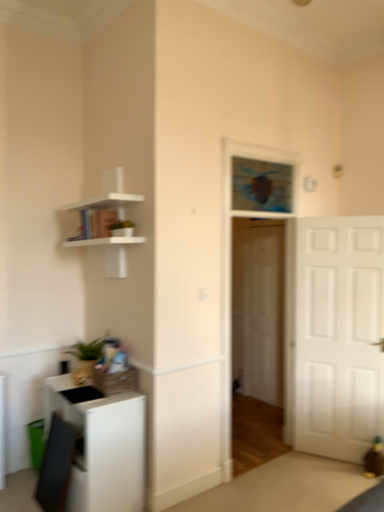
Question: Should I look upward or downward to see white matte cabinet at lower left?

Choices:
 (A) up
 (B) down

Answer: (B)

Question: Which direction should I rotate to look at white wooden door at center, which is the first door from back to front, — up or down?

Choices:
 (A) down
 (B) up

Answer: (A)

Question: Is white matte door at right, acting as the 1th door starting from the front, positioned in front of white matte shelf at upper left?

Choices:
 (A) no
 (B) yes

Answer: (A)

Question: Does white matte door at right, acting as the 1th door starting from the front, appear on the right side of white matte shelf at upper left?

Choices:
 (A) yes
 (B) no

Answer: (A)

Question: Is white matte door at right, acting as the 1th door starting from the front, outside of white matte shelf at upper left?

Choices:
 (A) no
 (B) yes

Answer: (B)

Question: Is white matte door at right, which is the second door in back-to-front order, shorter than white matte shelf at upper left?

Choices:
 (A) no
 (B) yes

Answer: (A)

Question: Could you tell me if white matte door at right, acting as the 1th door starting from the front, is turned towards white matte shelf at upper left?

Choices:
 (A) yes
 (B) no

Answer: (B)

Question: From a real-world perspective, is white matte door at right, acting as the 1th door starting from the front, located higher than white matte shelf at upper left?

Choices:
 (A) yes
 (B) no

Answer: (B)

Question: Is white matte shelf at upper left next to white matte door at right, acting as the 1th door starting from the front, and touching it?

Choices:
 (A) no
 (B) yes

Answer: (A)

Question: From the image's perspective, would you say white matte shelf at upper left is positioned over white matte door at right, acting as the 1th door starting from the front?

Choices:
 (A) no
 (B) yes

Answer: (B)

Question: Can you confirm if white matte shelf at upper left is taller than white matte door at right, acting as the 1th door starting from the front?

Choices:
 (A) no
 (B) yes

Answer: (A)

Question: Is white matte shelf at upper left at the left side of white matte door at right, acting as the 1th door starting from the front?

Choices:
 (A) yes
 (B) no

Answer: (A)

Question: Is white matte shelf at upper left not near white matte door at right, acting as the 1th door starting from the front?

Choices:
 (A) no
 (B) yes

Answer: (B)

Question: From the image's perspective, is white matte shelf at upper left located beneath white matte door at right, which is the second door in back-to-front order?

Choices:
 (A) no
 (B) yes

Answer: (A)

Question: Is white matte shelf at upper left positioned far away from blue glass window at center?

Choices:
 (A) yes
 (B) no

Answer: (A)